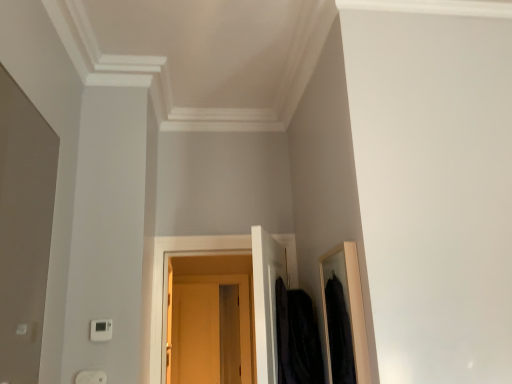
Question: Considering the positions of matte wood door at center and white plastic thermostat at lower left in the image, is matte wood door at center wider or thinner than white plastic thermostat at lower left?

Choices:
 (A) thin
 (B) wide

Answer: (B)

Question: Is matte wood door at center taller or shorter than white plastic thermostat at lower left?

Choices:
 (A) short
 (B) tall

Answer: (B)

Question: Which is farther from the white plastic thermostat at lower left?

Choices:
 (A) velvet black coat at right
 (B) white plastic electric outlet at lower left
 (C) matte wood door at center

Answer: (C)

Question: Which object is positioned farthest from the velvet black coat at right?

Choices:
 (A) matte wood door at center
 (B) white plastic thermostat at lower left
 (C) white plastic electric outlet at lower left

Answer: (A)